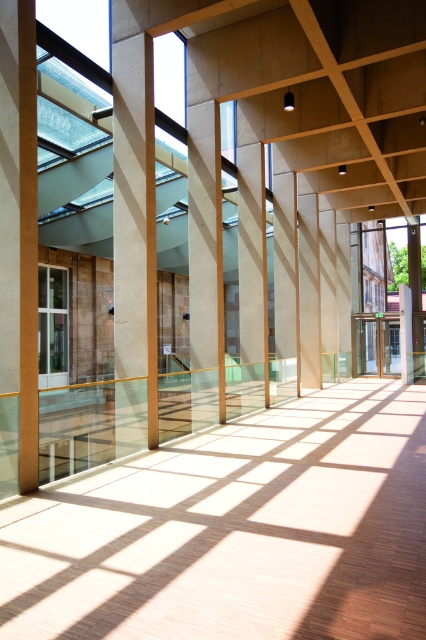
Question: Is smooth glass floor at center bigger than concrete pillar at center?

Choices:
 (A) yes
 (B) no

Answer: (A)

Question: Can you confirm if smooth glass floor at center is positioned to the left of concrete pillar at center?

Choices:
 (A) no
 (B) yes

Answer: (A)

Question: In this image, where is smooth glass floor at center located relative to concrete pillar at center?

Choices:
 (A) right
 (B) left

Answer: (A)

Question: Which object appears closest to the camera in this image?

Choices:
 (A) smooth glass floor at center
 (B) concrete pillar at center

Answer: (A)

Question: Which object appears farthest from the camera in this image?

Choices:
 (A) smooth glass floor at center
 (B) concrete pillar at center

Answer: (B)